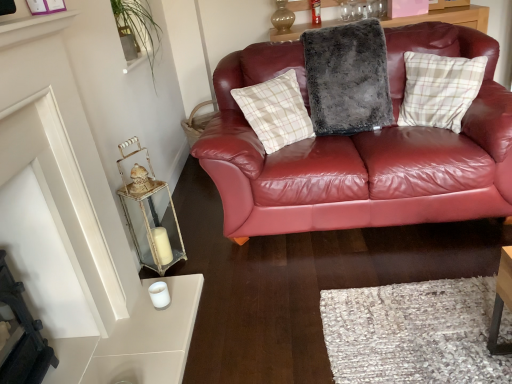
Question: Which direction should I rotate to face fuzzy gray pillow at center, which is counted as the second pillow, starting from the right, — up or down?

Choices:
 (A) down
 (B) up

Answer: (B)

Question: Is fuzzy gray pillow at center, which is counted as the second pillow, starting from the right, not within white glossy shelf at upper left?

Choices:
 (A) yes
 (B) no

Answer: (A)

Question: Is fuzzy gray pillow at center, the first pillow viewed from the left, further to the viewer compared to white glossy shelf at upper left?

Choices:
 (A) no
 (B) yes

Answer: (B)

Question: Is fuzzy gray pillow at center, which is counted as the second pillow, starting from the right, taller than white glossy shelf at upper left?

Choices:
 (A) yes
 (B) no

Answer: (A)

Question: Is fuzzy gray pillow at center, the first pillow viewed from the left, to the right of white glossy shelf at upper left from the viewer's perspective?

Choices:
 (A) no
 (B) yes

Answer: (B)

Question: Considering the relative sizes of fuzzy gray pillow at center, the first pillow viewed from the left, and white glossy shelf at upper left in the image provided, is fuzzy gray pillow at center, the first pillow viewed from the left, smaller than white glossy shelf at upper left?

Choices:
 (A) no
 (B) yes

Answer: (A)

Question: Can you confirm if fuzzy gray pillow at center, the first pillow viewed from the left, is wider than white glossy shelf at upper left?

Choices:
 (A) no
 (B) yes

Answer: (B)

Question: Is fuzzy gray pillow at center, which is counted as the second pillow, starting from the right, located within plaid fabric pillow at upper right, acting as the 1th pillow starting from the right?

Choices:
 (A) no
 (B) yes

Answer: (A)

Question: From a real-world perspective, is plaid fabric pillow at upper right, the 2th pillow from the left, positioned over fuzzy gray pillow at center, the first pillow viewed from the left, based on gravity?

Choices:
 (A) yes
 (B) no

Answer: (B)

Question: Considering the relative positions of plaid fabric pillow at upper right, the 2th pillow from the left, and fuzzy gray pillow at center, which is counted as the second pillow, starting from the right, in the image provided, is plaid fabric pillow at upper right, the 2th pillow from the left, in front of fuzzy gray pillow at center, which is counted as the second pillow, starting from the right,?

Choices:
 (A) yes
 (B) no

Answer: (A)

Question: Does plaid fabric pillow at upper right, acting as the 1th pillow starting from the right, have a lesser height compared to fuzzy gray pillow at center, which is counted as the second pillow, starting from the right?

Choices:
 (A) no
 (B) yes

Answer: (B)

Question: From the image's perspective, is plaid fabric pillow at upper right, the 2th pillow from the left, on fuzzy gray pillow at center, the first pillow viewed from the left?

Choices:
 (A) no
 (B) yes

Answer: (A)

Question: From the image's perspective, is plaid fabric pillow at upper right, acting as the 1th pillow starting from the right, under fuzzy gray pillow at center, the first pillow viewed from the left?

Choices:
 (A) yes
 (B) no

Answer: (A)

Question: Is plaid fabric pillow at upper right, acting as the 1th pillow starting from the right, located within metallic glass lantern at left?

Choices:
 (A) no
 (B) yes

Answer: (A)